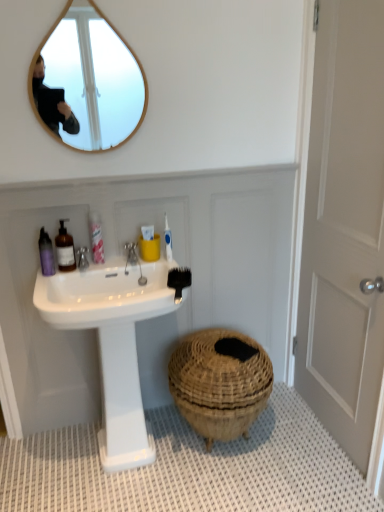
Where is `free location to the right of brown woven basket at lower center`? free location to the right of brown woven basket at lower center is located at coordinates (298, 446).